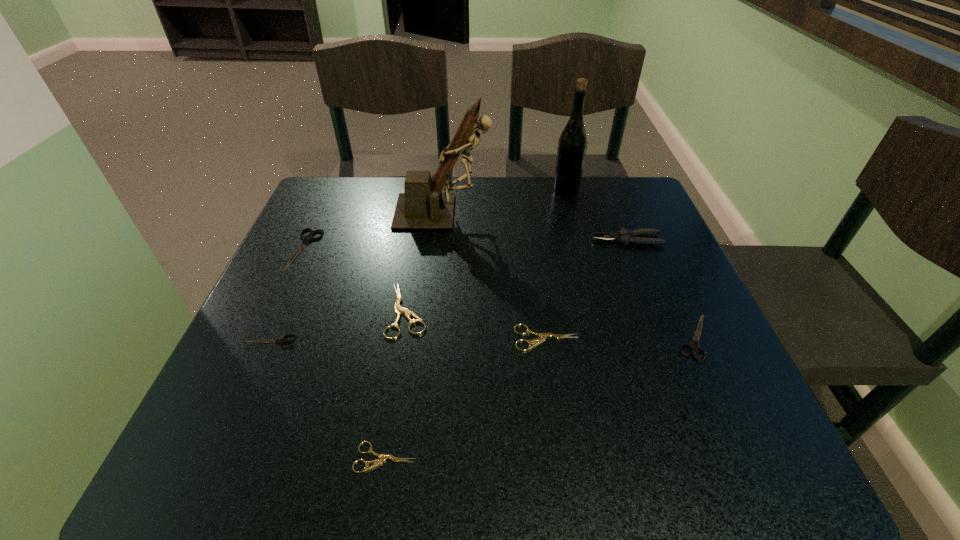
You are a GUI agent. You are given a task and a screenshot of the screen. Output one action in this format:
    pyautogui.click(x=<x>, y=<y>)
    Task: Click on the brown figurine
    
    Given the screenshot: What is the action you would take?
    pyautogui.click(x=423, y=206)

Locate an element on the screen. The width and height of the screenshot is (960, 540). green beer bottle is located at coordinates (572, 145).

Find the location of a particular element. The height and width of the screenshot is (540, 960). gray pliers is located at coordinates (625, 236).

What are the coordinates of `the third tallest object` in the screenshot? It's located at (625, 236).

Identify the location of the farthest shears. (306, 239).

This screenshot has height=540, width=960. What are the coordinates of `the fourth tallest object` in the screenshot? It's located at (306, 239).

Where is `the rightmost shears`? the rightmost shears is located at coordinates (694, 347).

Identify the location of the second biggest black shears. Image resolution: width=960 pixels, height=540 pixels. (694, 347).

Where is `the biggest beige shears`? This screenshot has height=540, width=960. the biggest beige shears is located at coordinates (399, 310).

The height and width of the screenshot is (540, 960). I want to click on the fifth shears from left to right, so click(544, 336).